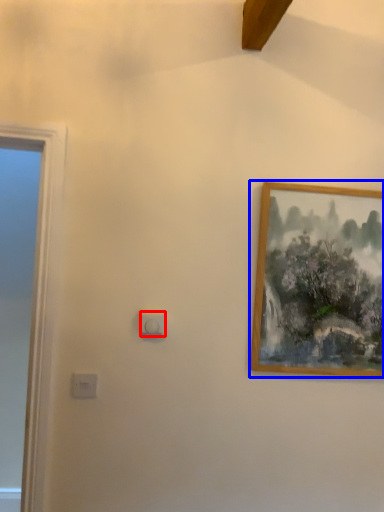
Question: Which object appears closest to the camera in this image, light switch (highlighted by a red box) or picture frame (highlighted by a blue box)?

Choices:
 (A) light switch
 (B) picture frame

Answer: (A)